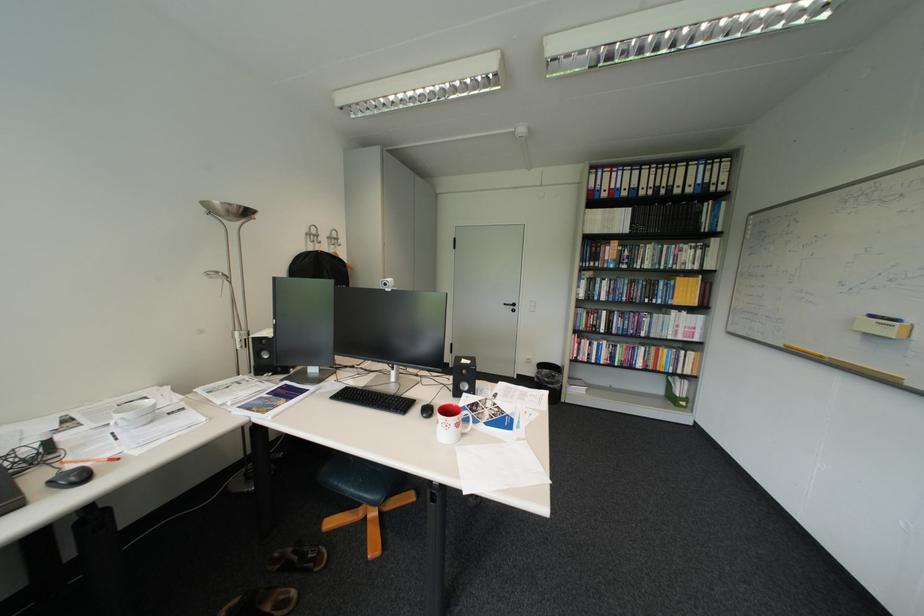
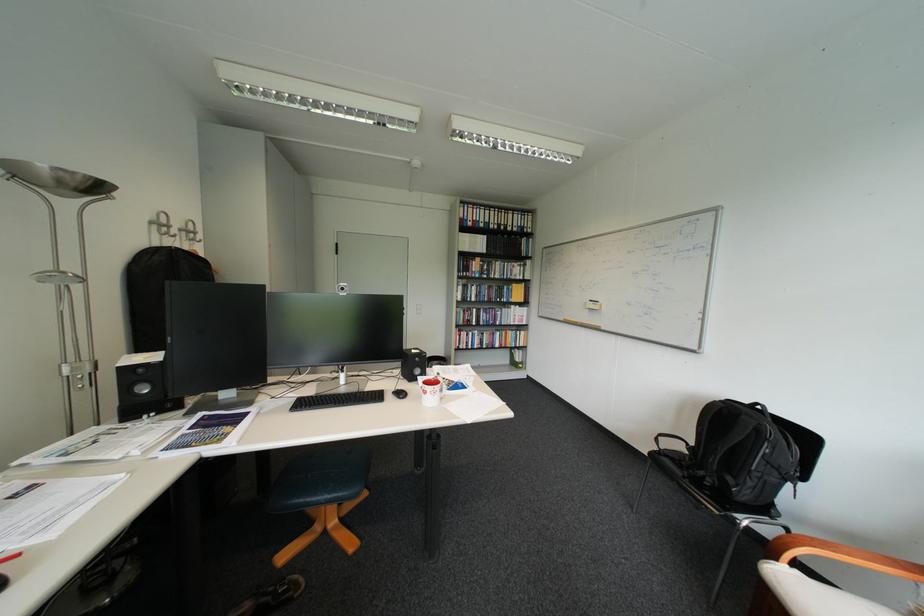
Question: The camera is either moving clockwise (left) or counter-clockwise (right) around the object. The first image is from the beginning of the video and the second image is from the end. Is the camera moving left or right when shooting the video?

Choices:
 (A) Left
 (B) Right

Answer: (A)